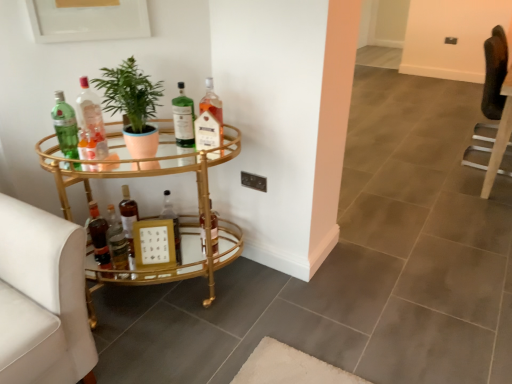
The height and width of the screenshot is (384, 512). In order to click on vacant space situated on the left part of leather swivel chair at right, the 2th swivel chair from the left in this screenshot , I will do `click(440, 159)`.